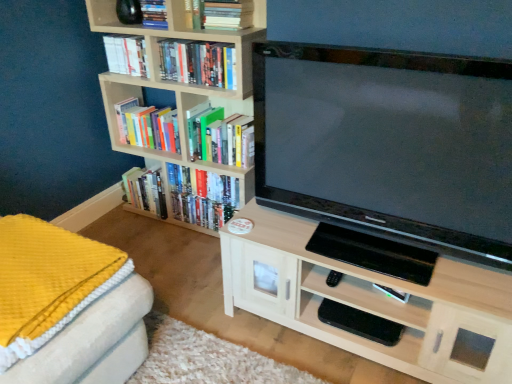
Question: From the image's perspective, relative to light wood cabinet at center, marked as the 1th shelf in a right-to-left arrangement, is hardcover book at upper center, placed as the second book when sorted from top to bottom, above or below?

Choices:
 (A) above
 (B) below

Answer: (A)

Question: Is hardcover book at upper center, which ranks as the fifth book in bottom-to-top order, taller or shorter than light wood cabinet at center, which is counted as the second shelf, starting from the left?

Choices:
 (A) short
 (B) tall

Answer: (A)

Question: Estimate the real-world distances between objects in this image. Which object is closer to the hardcover book at upper left, marked as the third book in a top-to-bottom arrangement?

Choices:
 (A) wooden bookshelf at left
 (B) matte black mouse at upper left, acting as the 2th shelf starting from the bottom
 (C) yellow textured blanket at lower left
 (D) hardcover book at center, which is the sixth book in top-to-bottom order
 (E) hardcover books at upper center, the 4th book positioned from the top

Answer: (B)

Question: Based on their relative distances, which object is nearer to the hardcover book at upper left, which is the 4th book in bottom-to-top order?

Choices:
 (A) hardcover book at upper center, acting as the 1th book starting from the top
 (B) hardcover book at upper center, placed as the second book when sorted from top to bottom
 (C) hardcover book at center, which is the sixth book in top-to-bottom order
 (D) wooden bookshelf at left
 (E) yellow textured blanket at lower left

Answer: (A)